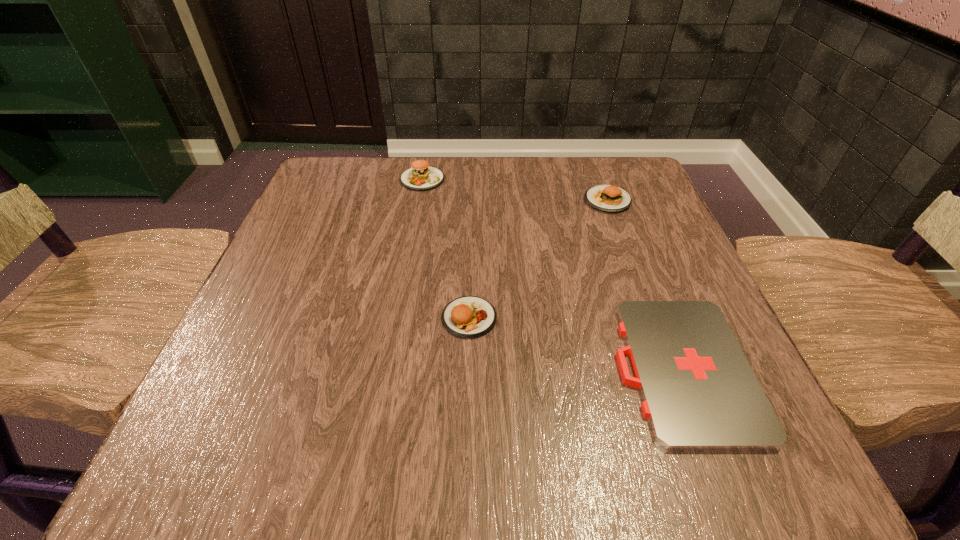
This screenshot has height=540, width=960. In the image, there is a desktop. In order to click on vacant space at the far left corner in this screenshot , I will do `click(324, 173)`.

This screenshot has height=540, width=960. I want to click on vacant space at the near left corner, so click(x=181, y=442).

Locate an element on the screen. free spot at the far right corner of the desktop is located at coordinates (622, 176).

Identify the location of empty space between the third object from right to left and the shortest object. This screenshot has width=960, height=540. (576, 343).

Find the location of a particular element. The image size is (960, 540). empty space that is in between the rightmost patty (food) and the shortest object is located at coordinates (644, 285).

At what (x,y) coordinates should I click in order to perform the action: click on vacant point located between the leftmost patty (food) and the second patty (food) from left to right. Please return your answer as a coordinate pair (x, y). Looking at the image, I should click on (445, 248).

Identify the location of blank region between the first-aid kit and the rightmost patty (food). (644, 285).

Find the location of a particular element. Image resolution: width=960 pixels, height=540 pixels. vacant area that lies between the shortest patty (food) and the rightmost patty (food) is located at coordinates (539, 259).

Find the location of `free area in between the first-aid kit and the second patty (food) from left to right`. free area in between the first-aid kit and the second patty (food) from left to right is located at coordinates (576, 343).

Locate an element on the screen. unoccupied area between the leftmost patty (food) and the rightmost patty (food) is located at coordinates (515, 190).